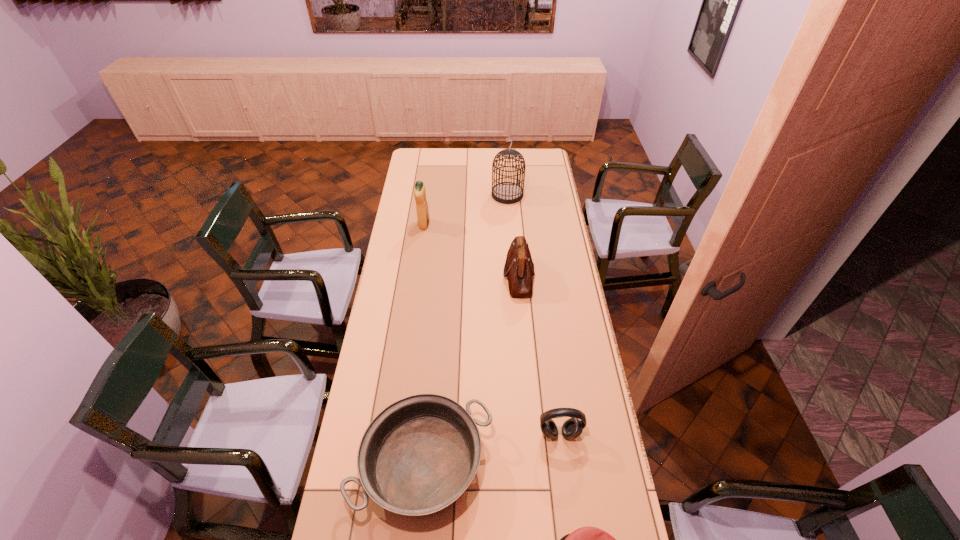
Identify the location of free space located on the left of the shoulder bag. (460, 276).

Locate an element on the screen. The height and width of the screenshot is (540, 960). vacant space located on the earcups of the fourth tallest object is located at coordinates (571, 524).

Locate an element on the screen. The height and width of the screenshot is (540, 960). vacant space positioned on the right of the second shortest object is located at coordinates (612, 464).

You are a GUI agent. You are given a task and a screenshot of the screen. Output one action in this format:
    pyautogui.click(x=<x>, y=<y>)
    Task: Click on the detergent located at the left edge
    Image resolution: width=960 pixels, height=540 pixels.
    Given the screenshot: What is the action you would take?
    pyautogui.click(x=419, y=190)

Find the location of a particular element. pan that is at the left edge is located at coordinates (418, 455).

This screenshot has height=540, width=960. In order to click on object present at the right edge in this screenshot , I will do `click(572, 428)`.

You are a GUI agent. You are given a task and a screenshot of the screen. Output one action in this format:
    pyautogui.click(x=<x>, y=<y>)
    Task: Click on the blank area at the left edge
    
    Given the screenshot: What is the action you would take?
    pyautogui.click(x=355, y=434)

You are a GUI agent. You are given a task and a screenshot of the screen. Output one action in this format:
    pyautogui.click(x=<x>, y=<y>)
    Task: Click on the vacant space at the right edge
    
    Given the screenshot: What is the action you would take?
    pyautogui.click(x=575, y=274)

At what (x,y) coordinates should I click in order to perform the action: click on vacant position at the far right corner of the desktop. Please return your answer as a coordinate pair (x, y). Looking at the image, I should click on (551, 170).

This screenshot has height=540, width=960. I want to click on empty location between the third tallest object and the detergent, so click(471, 251).